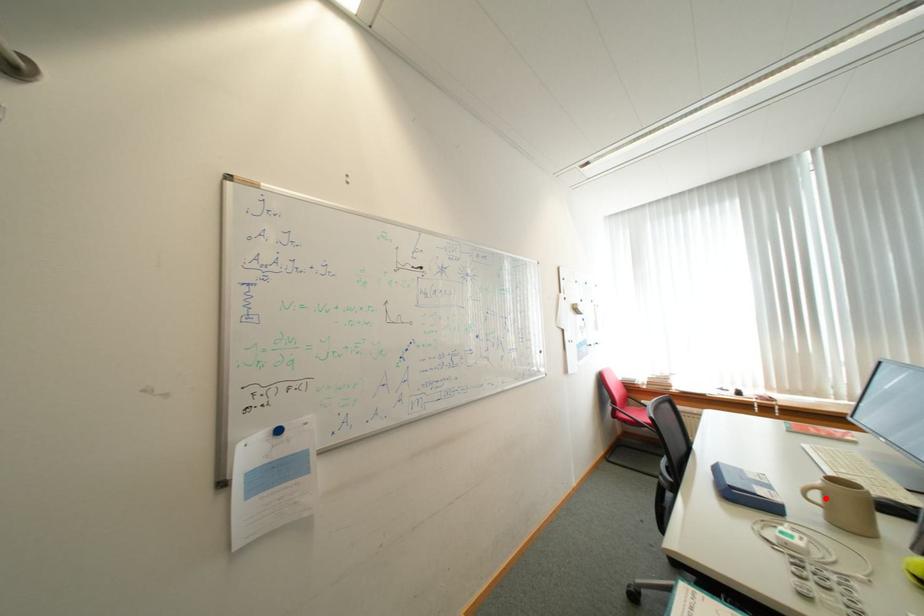
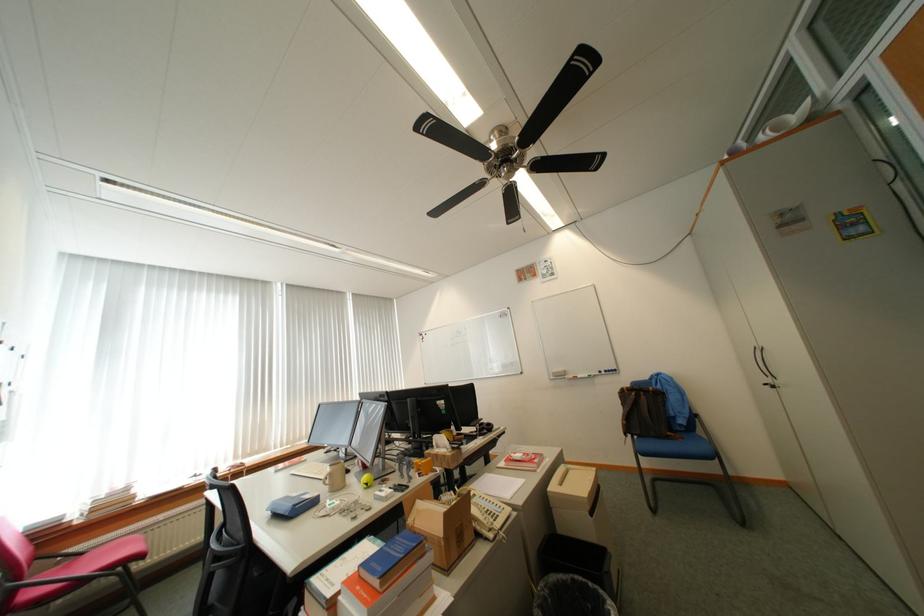
The point at the highlighted location is marked in the first image. Where is the corresponding point in the second image?

(336, 482)